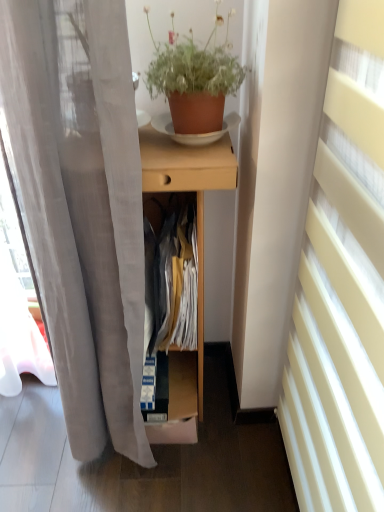
Question: From the image's perspective, is white sheer curtain at right positioned above or below cardboard box at center?

Choices:
 (A) below
 (B) above

Answer: (B)

Question: Is white sheer curtain at right to the left or to the right of cardboard box at center in the image?

Choices:
 (A) left
 (B) right

Answer: (B)

Question: Estimate the real-world distances between objects in this image. Which object is farther from the cardboard box at center?

Choices:
 (A) light wood desk at center
 (B) terracotta clay pot at upper center
 (C) white sheer curtain at right
 (D) matte cardboard cabinet at center

Answer: (B)

Question: Estimate the real-world distances between objects in this image. Which object is closer to the white sheer curtain at right?

Choices:
 (A) light wood desk at center
 (B) terracotta clay pot at upper center
 (C) cardboard box at center
 (D) matte cardboard cabinet at center

Answer: (A)